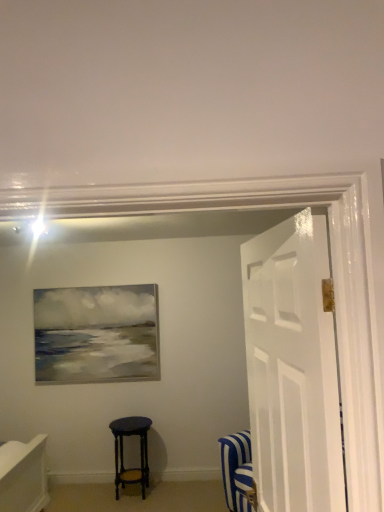
Find the location of a particular element. The height and width of the screenshot is (512, 384). matte black stool at center is located at coordinates (122, 451).

What do you see at coordinates (122, 451) in the screenshot?
I see `matte black stool at center` at bounding box center [122, 451].

Measure the distance between point (273, 420) and camera.

A distance of 4.95 feet exists between point (273, 420) and camera.

Image resolution: width=384 pixels, height=512 pixels. Describe the element at coordinates (292, 367) in the screenshot. I see `white glossy door at right` at that location.

The height and width of the screenshot is (512, 384). In order to click on white glossy door at right in this screenshot , I will do tap(292, 367).

Locate an element on the screen. The height and width of the screenshot is (512, 384). matte black stool at center is located at coordinates (122, 451).

Is matte black stool at center at the right side of white glossy door at right?

In fact, matte black stool at center is to the left of white glossy door at right.

In the image, is matte black stool at center positioned in front of or behind white glossy door at right?

Clearly, matte black stool at center is behind white glossy door at right.

Between point (150, 423) and point (285, 448), which one is positioned behind?

The point (150, 423) is behind.

From the image's perspective, who appears lower, matte black stool at center or white glossy door at right?

matte black stool at center appears lower in the image.

From a real-world perspective, who is located lower, matte black stool at center or white glossy door at right?

matte black stool at center is physically lower.

Considering the sizes of objects matte black stool at center and white glossy door at right in the image provided, who is thinner, matte black stool at center or white glossy door at right?

With smaller width is white glossy door at right.

Which of these two, matte black stool at center or white glossy door at right, stands shorter?

Standing shorter between the two is matte black stool at center.

Based on their sizes in the image, would you say matte black stool at center is bigger or smaller than white glossy door at right?

In the image, matte black stool at center appears to be smaller than white glossy door at right.

Is matte black stool at center spatially inside white glossy door at right, or outside of it?

The correct answer is: outside.

Would you say matte black stool at center is a long distance from white glossy door at right?

Yes.

Is matte black stool at center facing away from white glossy door at right?

No, matte black stool at center is not facing the opposite direction of white glossy door at right.

How different are the orientations of matte black stool at center and white glossy door at right in degrees?

They differ by 85.1 degrees in their facing directions.

Where is `stool lying below the white glossy door at right (from the image's perspective)`? This screenshot has width=384, height=512. stool lying below the white glossy door at right (from the image's perspective) is located at coordinates (122, 451).

Which is more to the right, white glossy door at right or matte black stool at center?

white glossy door at right.

Which object is further away from the camera, white glossy door at right or matte black stool at center?

matte black stool at center is further from the camera.

Considering the positions of points (254, 471) and (134, 475), is point (254, 471) farther from camera compared to point (134, 475)?

No.

In the scene shown: From the image's perspective, which object appears higher, white glossy door at right or matte black stool at center?

white glossy door at right.

From a real-world perspective, which object stands above the other?

white glossy door at right.

From the picture: Does white glossy door at right have a greater width compared to matte black stool at center?

Incorrect, the width of white glossy door at right does not surpass that of matte black stool at center.

Is white glossy door at right taller or shorter than matte black stool at center?

Considering their sizes, white glossy door at right has more height than matte black stool at center.

Who is smaller, white glossy door at right or matte black stool at center?

matte black stool at center.

Could matte black stool at center be considered to be inside white glossy door at right?

Actually, matte black stool at center is outside white glossy door at right.

Is white glossy door at right placed right next to matte black stool at center?

There is a gap between white glossy door at right and matte black stool at center.

Is white glossy door at right turned away from matte black stool at center?

No, white glossy door at right is not facing away from matte black stool at center.

Can you tell me how much white glossy door at right and matte black stool at center differ in facing direction?

85.1 degrees separate the facing orientations of white glossy door at right and matte black stool at center.

Where is `stool located below the white glossy door at right (from the image's perspective)`? stool located below the white glossy door at right (from the image's perspective) is located at coordinates (122, 451).

Image resolution: width=384 pixels, height=512 pixels. Find the location of `door above the matte black stool at center (from the image's perspective)`. door above the matte black stool at center (from the image's perspective) is located at coordinates (292, 367).

Locate an element on the screen. Image resolution: width=384 pixels, height=512 pixels. door in front of the matte black stool at center is located at coordinates (292, 367).